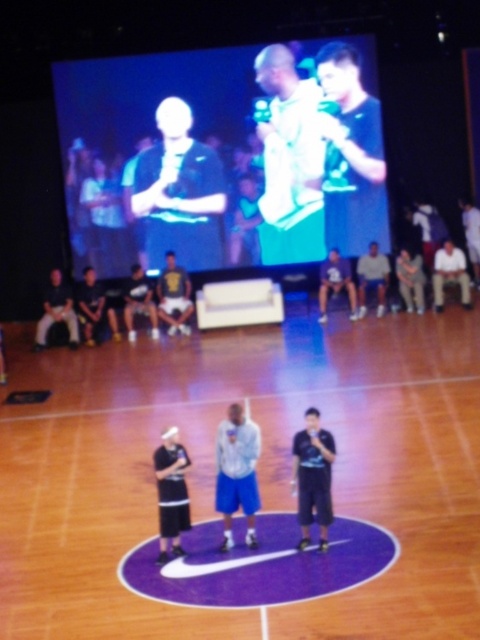
You are a photographer positioned at the front of the court. You want to take a photo that includes both the point at point [226,497] and the point at point [160,525]. Which point will appear closer to the edge of the photo if you frame the shot to include both points?

Point [160,525] will appear closer to the edge of the photo because it is closer to the photographer than point [226,497], which is further away. Since the photographer is at the front, the closer point would be nearer to the edge when both are included in the frame.